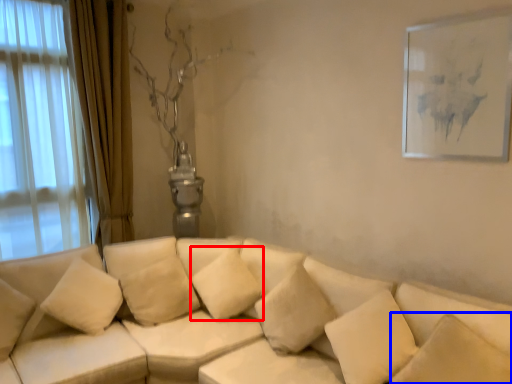
Question: Which object is further to the camera taking this photo, pillow (highlighted by a red box) or pillow (highlighted by a blue box)?

Choices:
 (A) pillow
 (B) pillow

Answer: (A)